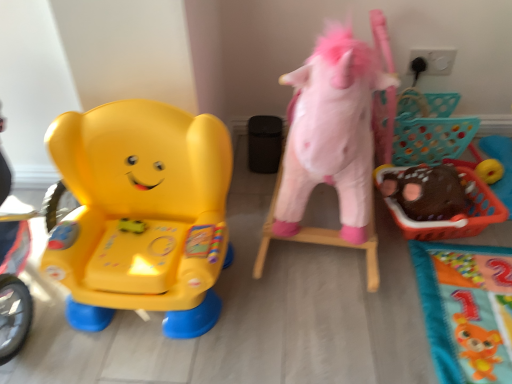
Question: Should I look upward or downward to see fluffy pink unicorn at right, arranged as the 2th toy when viewed from the right?

Choices:
 (A) down
 (B) up

Answer: (B)

Question: Is fluffy pink unicorn at right, arranged as the 2th toy when viewed from the right, thinner than brown fuzzy plush at right, which appears as the first toy when viewed from the right?

Choices:
 (A) no
 (B) yes

Answer: (A)

Question: Is fluffy pink unicorn at right, arranged as the 2th toy when viewed from the right, positioned before brown fuzzy plush at right, which appears as the first toy when viewed from the right?

Choices:
 (A) no
 (B) yes

Answer: (B)

Question: Is fluffy pink unicorn at right, arranged as the 2th toy when viewed from the right, at the left side of brown fuzzy plush at right, which appears as the first toy when viewed from the right?

Choices:
 (A) no
 (B) yes

Answer: (B)

Question: Is fluffy pink unicorn at right, arranged as the 2th toy when viewed from the right, directly adjacent to brown fuzzy plush at right, which appears as the first toy when viewed from the right?

Choices:
 (A) no
 (B) yes

Answer: (A)

Question: Is fluffy pink unicorn at right, arranged as the 2th toy when viewed from the right, smaller than brown fuzzy plush at right, which appears as the 3th toy when viewed from the left?

Choices:
 (A) no
 (B) yes

Answer: (A)

Question: From a real-world perspective, is fluffy pink unicorn at right, which is the 2th toy from left to right, over brown fuzzy plush at right, which appears as the first toy when viewed from the right?

Choices:
 (A) no
 (B) yes

Answer: (B)

Question: Is brown fuzzy plush at right, which appears as the first toy when viewed from the right, oriented away from matte plastic elephant at left, which appears as the third toy when viewed from the right?

Choices:
 (A) yes
 (B) no

Answer: (B)

Question: Is brown fuzzy plush at right, which appears as the 3th toy when viewed from the left, positioned in front of matte plastic elephant at left, the first toy viewed from the left?

Choices:
 (A) yes
 (B) no

Answer: (B)

Question: Does brown fuzzy plush at right, which appears as the first toy when viewed from the right, appear on the left side of matte plastic elephant at left, the first toy viewed from the left?

Choices:
 (A) yes
 (B) no

Answer: (B)

Question: Considering the relative sizes of brown fuzzy plush at right, which appears as the 3th toy when viewed from the left, and matte plastic elephant at left, the first toy viewed from the left, in the image provided, is brown fuzzy plush at right, which appears as the 3th toy when viewed from the left, bigger than matte plastic elephant at left, the first toy viewed from the left,?

Choices:
 (A) yes
 (B) no

Answer: (B)

Question: Is brown fuzzy plush at right, which appears as the 3th toy when viewed from the left, wider than matte plastic elephant at left, the first toy viewed from the left?

Choices:
 (A) yes
 (B) no

Answer: (B)

Question: Can we say brown fuzzy plush at right, which appears as the first toy when viewed from the right, lies outside matte plastic elephant at left, the first toy viewed from the left?

Choices:
 (A) yes
 (B) no

Answer: (A)

Question: Is fluffy pink unicorn at right, which is the 2th toy from left to right, oriented towards matte plastic elephant at left, which appears as the third toy when viewed from the right?

Choices:
 (A) yes
 (B) no

Answer: (B)